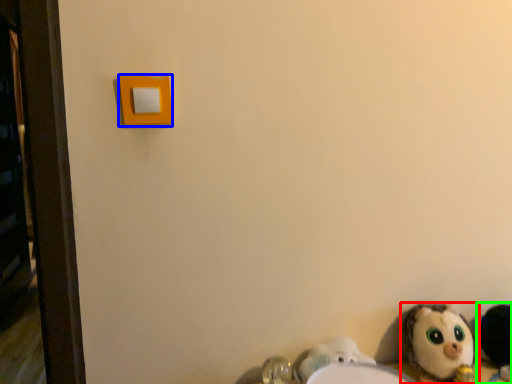
Question: Which object is the closest to the toy (highlighted by a red box)? Choose among these: light switch (highlighted by a blue box) or toy (highlighted by a green box).

Choices:
 (A) light switch
 (B) toy

Answer: (B)